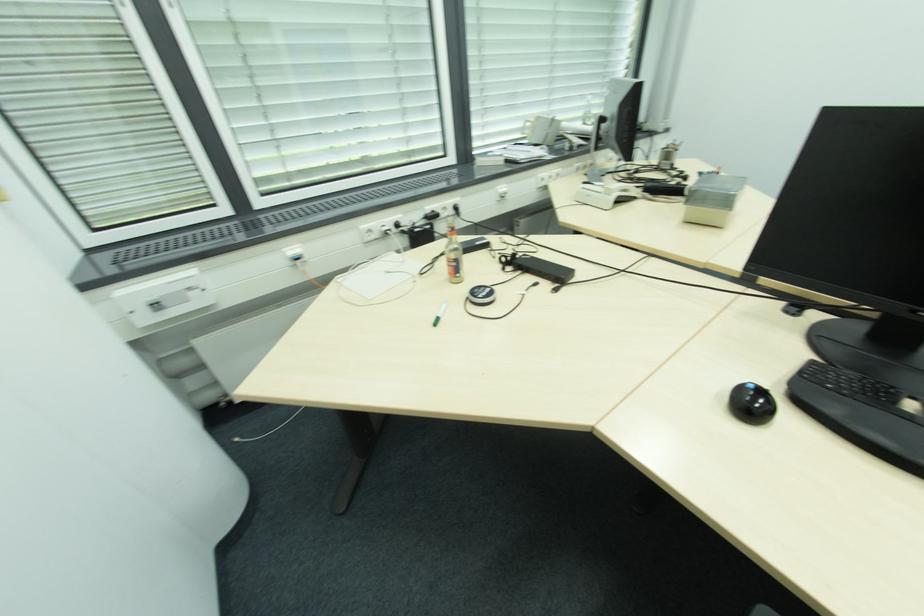
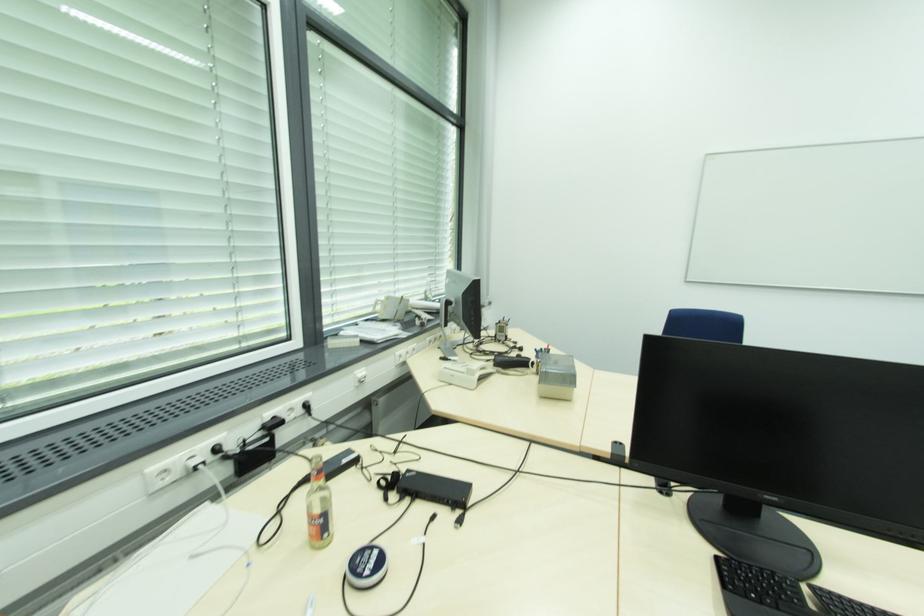
Locate, in the second image, the point that corresponds to the point at 460,276 in the first image.

(329, 535)